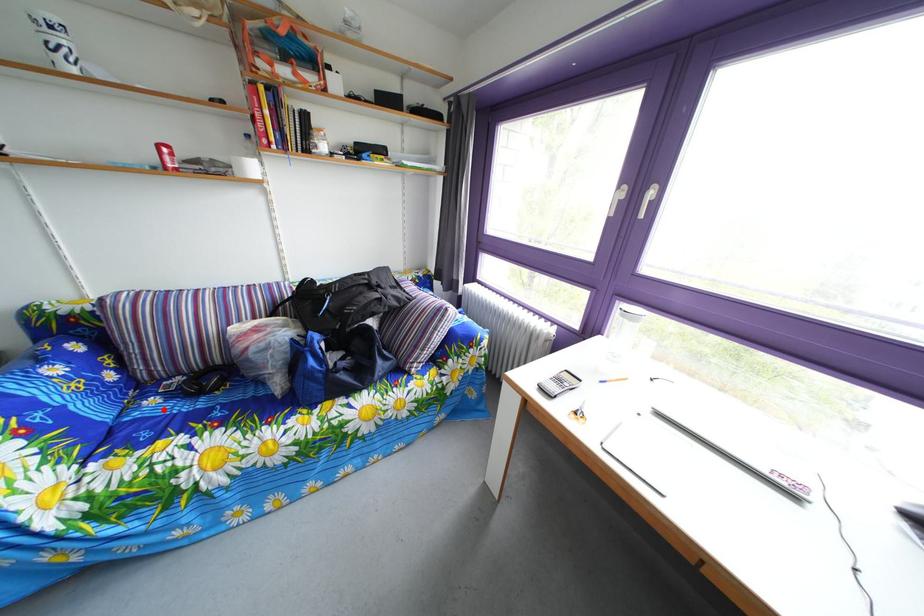
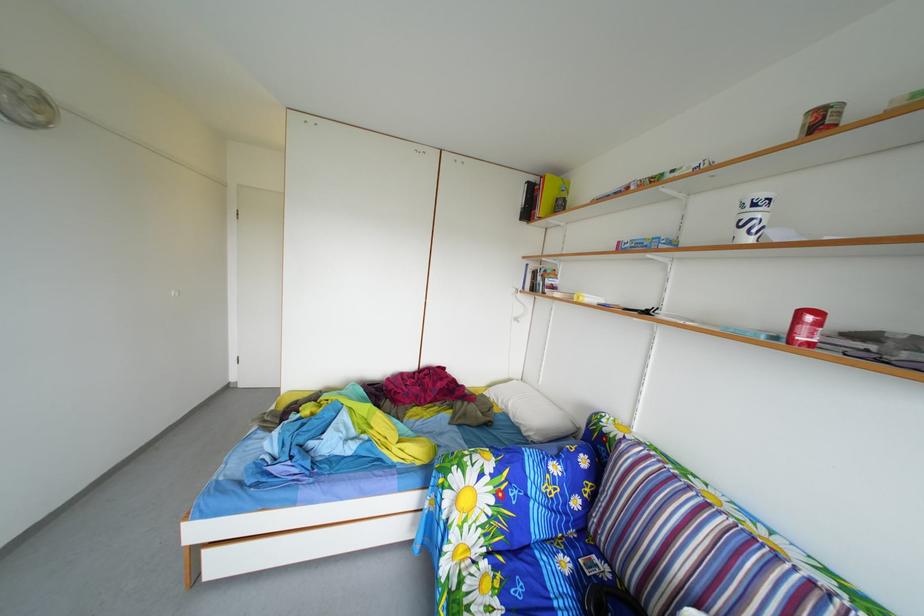
In the second image, find the point that corresponds to the highlighted location in the first image.

(576, 570)